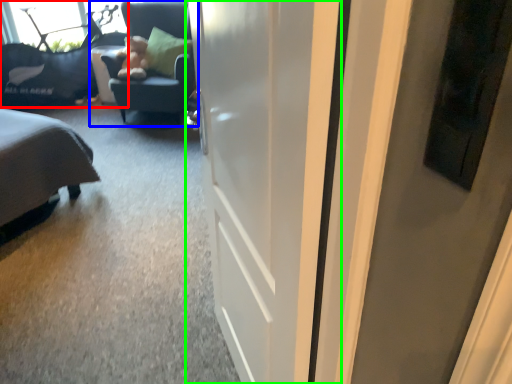
Question: Which object is positioned farthest from furniture (highlighted by a red box)? Select from chair (highlighted by a blue box) and door (highlighted by a green box).

Choices:
 (A) chair
 (B) door

Answer: (B)